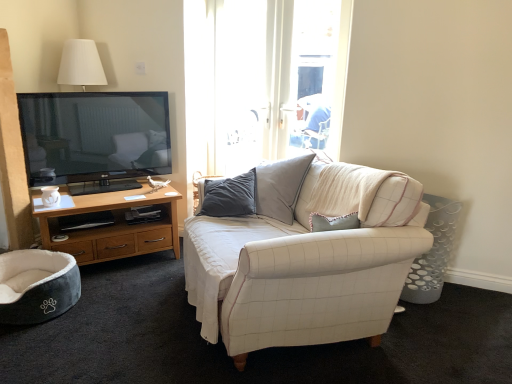
Question: Does matte white coffee cup at left have a greater width compared to white fabric couch at center?

Choices:
 (A) yes
 (B) no

Answer: (B)

Question: Does matte white coffee cup at left appear on the right side of white fabric couch at center?

Choices:
 (A) yes
 (B) no

Answer: (B)

Question: From the image's perspective, is matte white coffee cup at left located beneath white fabric couch at center?

Choices:
 (A) yes
 (B) no

Answer: (B)

Question: Can you confirm if matte white coffee cup at left is shorter than white fabric couch at center?

Choices:
 (A) no
 (B) yes

Answer: (B)

Question: Could white fabric couch at center be considered to be inside matte white coffee cup at left?

Choices:
 (A) yes
 (B) no

Answer: (B)

Question: Is point (50, 193) positioned closer to the camera than point (302, 236)?

Choices:
 (A) farther
 (B) closer

Answer: (A)

Question: Is matte white coffee cup at left inside or outside of white fabric couch at center?

Choices:
 (A) outside
 (B) inside

Answer: (A)

Question: In terms of size, does matte white coffee cup at left appear bigger or smaller than white fabric couch at center?

Choices:
 (A) small
 (B) big

Answer: (A)

Question: In the image, is matte white coffee cup at left on the left side or the right side of white fabric couch at center?

Choices:
 (A) left
 (B) right

Answer: (A)

Question: Is matte white coffee cup at left wider or thinner than gray plush pet bed at lower left?

Choices:
 (A) thin
 (B) wide

Answer: (A)

Question: From the image's perspective, is matte white coffee cup at left positioned above or below gray plush pet bed at lower left?

Choices:
 (A) below
 (B) above

Answer: (B)

Question: Considering their positions, is matte white coffee cup at left located in front of or behind gray plush pet bed at lower left?

Choices:
 (A) behind
 (B) front

Answer: (A)

Question: From a real-world perspective, is matte white coffee cup at left physically located above or below gray plush pet bed at lower left?

Choices:
 (A) below
 (B) above

Answer: (B)

Question: Does point (19, 291) appear closer or farther from the camera than point (51, 188)?

Choices:
 (A) closer
 (B) farther

Answer: (A)

Question: Looking at their shapes, would you say gray plush pet bed at lower left is wider or thinner than matte white coffee cup at left?

Choices:
 (A) thin
 (B) wide

Answer: (B)